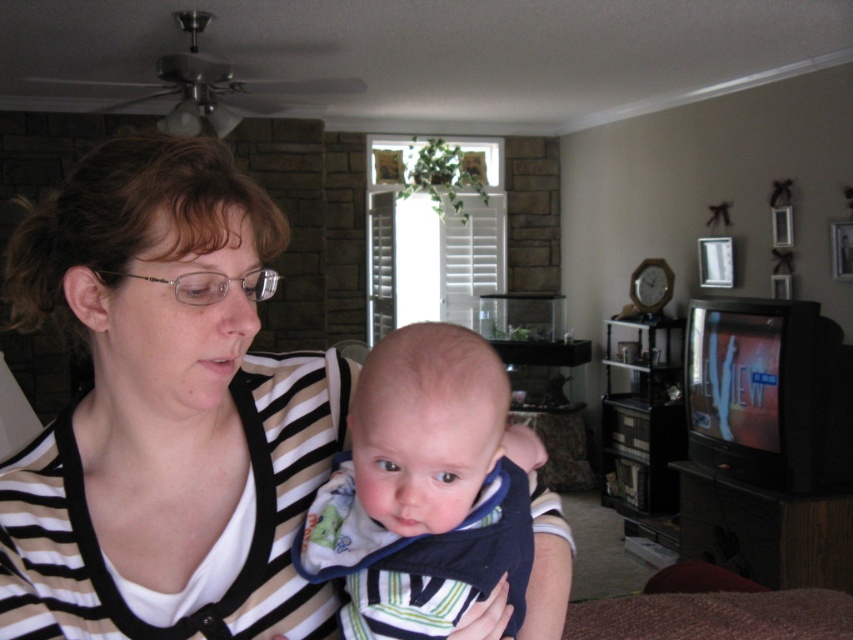
Question: Observing the image, what is the correct spatial positioning of striped fabric shirt at center in reference to striped fabric baby at center?

Choices:
 (A) left
 (B) right

Answer: (A)

Question: Which point appears closest to the camera in this image?

Choices:
 (A) (485, 547)
 (B) (263, 506)

Answer: (A)

Question: Can you confirm if striped fabric shirt at center is positioned to the right of striped fabric baby at center?

Choices:
 (A) no
 (B) yes

Answer: (A)

Question: Is striped fabric shirt at center to the right of striped fabric baby at center from the viewer's perspective?

Choices:
 (A) yes
 (B) no

Answer: (B)

Question: Which point is farther to the camera?

Choices:
 (A) (187, 381)
 (B) (408, 342)

Answer: (A)